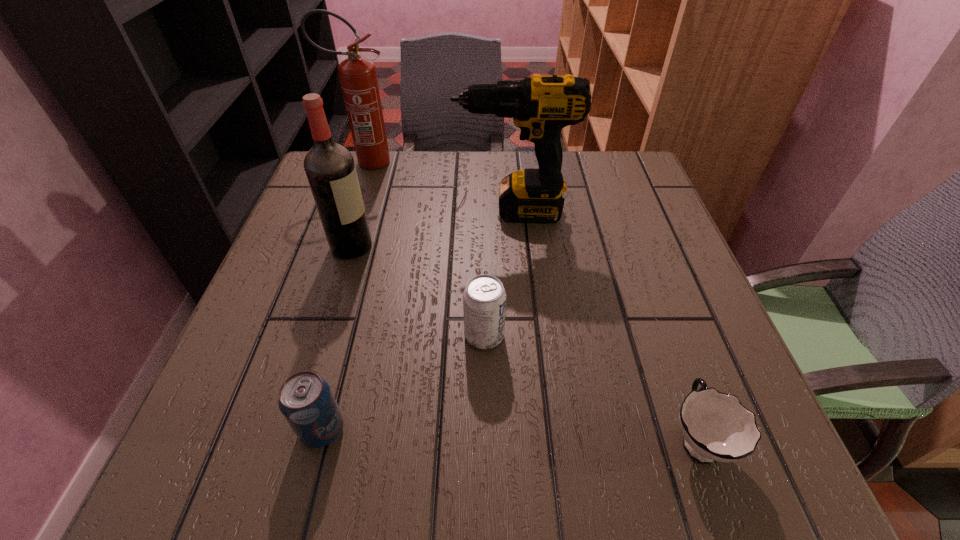
Where is `pop soda present at the near edge`? pop soda present at the near edge is located at coordinates (306, 401).

Identify the location of cup that is at the near edge. (715, 426).

At what (x,y) coordinates should I click in order to perform the action: click on fire extinguisher at the left edge. Please return your answer as a coordinate pair (x, y). Image resolution: width=960 pixels, height=540 pixels. Looking at the image, I should click on (358, 77).

Where is `liquor that is positioned at the left edge`? The width and height of the screenshot is (960, 540). liquor that is positioned at the left edge is located at coordinates (330, 168).

The height and width of the screenshot is (540, 960). What are the coordinates of `pop soda that is at the left edge` in the screenshot? It's located at (306, 401).

The width and height of the screenshot is (960, 540). Find the location of `object that is at the right edge`. object that is at the right edge is located at coordinates (715, 426).

Locate an element on the screen. The image size is (960, 540). object that is at the far left corner is located at coordinates (358, 77).

Locate an element on the screen. The width and height of the screenshot is (960, 540). object present at the near left corner is located at coordinates (306, 401).

The height and width of the screenshot is (540, 960). I want to click on object at the near right corner, so click(x=715, y=426).

In order to click on free space at the far edge in this screenshot , I will do `click(429, 156)`.